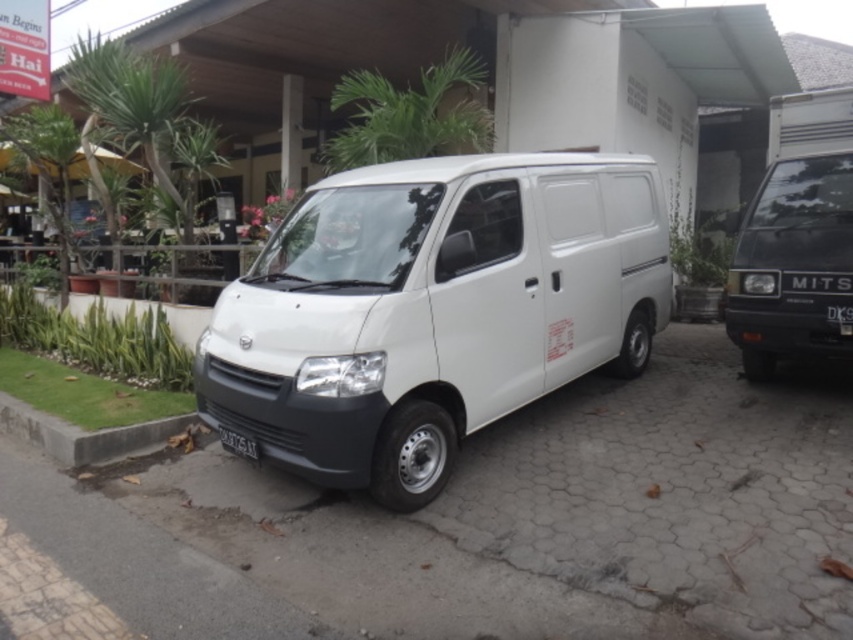
You are a traffic officer checking license plates. You observe a white plastic license plate at center and a black plastic license plate at center on the van. Which license plate is taller?

The white plastic license plate at center is much taller than the black plastic license plate at center.

You are a delivery driver who needs to park your white matte van at center so that its license plate is visible to security cameras. The black plastic license plate at center must be in the front of the van. Based on the scene, can you park the van in a way that meets this requirement?

The white matte van at center is to the left of the black plastic license plate at center, meaning the license plate is on the right side of the van. Since the license plate must be in the front, this placement is not possible as the plate is on the side, not the front. Therefore, the van cannot be parked to meet the requirement.

You are a parking attendant and need to check the license plates of the van. You see the white plastic license plate at center and the black plastic license plate at center. Which license plate is located to the left when viewed from the front of the van?

The white plastic license plate at center is positioned on the left side of the black plastic license plate at center, so the white plastic license plate at center is located to the left when viewed from the front of the van.